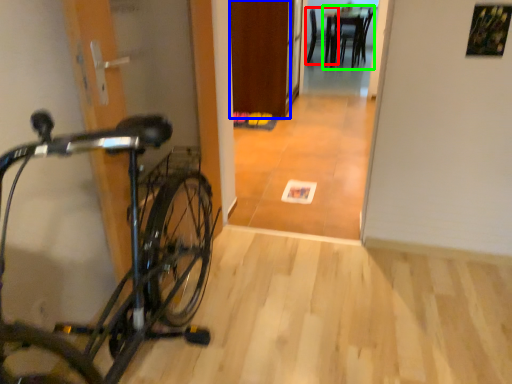
Question: Which is farther away from chair (highlighted by a red box)? door (highlighted by a blue box) or table (highlighted by a green box)?

Choices:
 (A) door
 (B) table

Answer: (A)